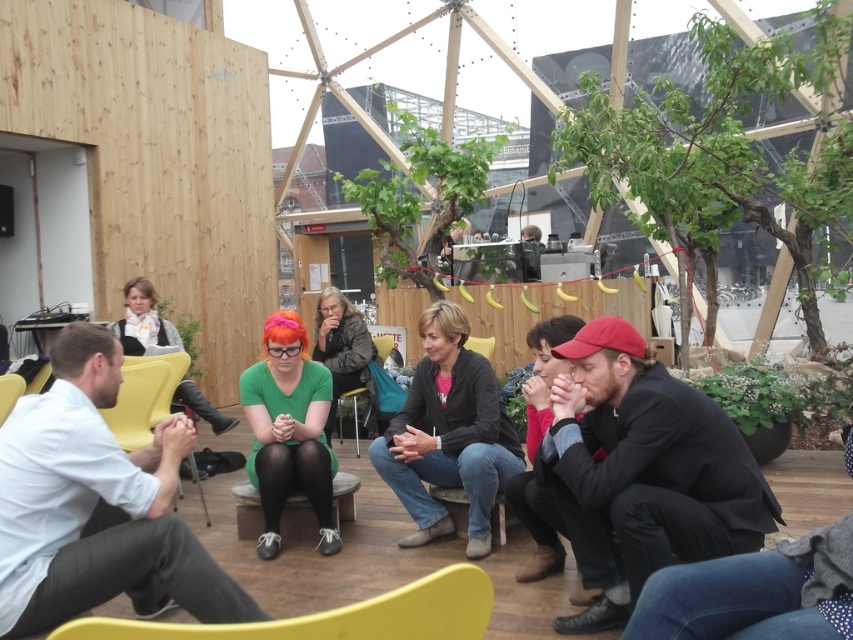
Based on the photo, you are at an outdoor event and need to sit down. You see a yellow plastic chair at lower left and a green fabric chair at center. Which chair is positioned to the right of the other?

The yellow plastic chair at lower left is to the right of the green fabric chair at center.